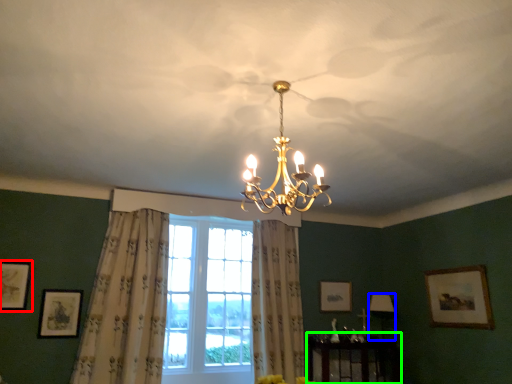
Question: Based on their relative distances, which object is farther from picture frame (highlighted by a red box)? Choose from lamp (highlighted by a blue box) and furniture (highlighted by a green box).

Choices:
 (A) lamp
 (B) furniture

Answer: (A)